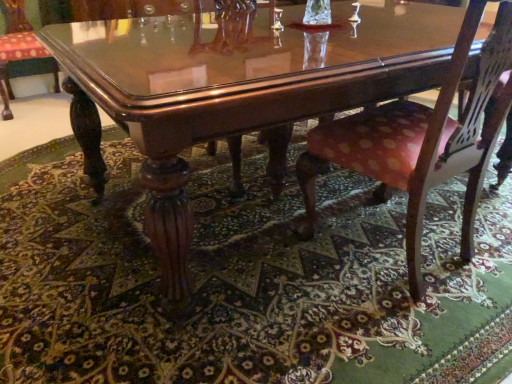
This screenshot has width=512, height=384. In order to click on free spot below polished wood chair at lower left, the first chair from the left (from a real-world perspective) in this screenshot , I will do `click(38, 106)`.